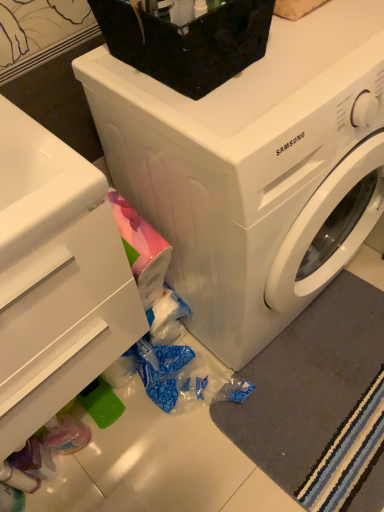
Question: Is white glossy drawer at lower left located outside black plastic container at upper center?

Choices:
 (A) no
 (B) yes

Answer: (B)

Question: From a real-world perspective, is white glossy drawer at lower left located beneath black plastic container at upper center?

Choices:
 (A) yes
 (B) no

Answer: (A)

Question: From a real-world perspective, is white glossy drawer at lower left on top of black plastic container at upper center?

Choices:
 (A) yes
 (B) no

Answer: (B)

Question: Does white glossy drawer at lower left appear on the left side of black plastic container at upper center?

Choices:
 (A) no
 (B) yes

Answer: (B)

Question: Does white glossy drawer at lower left have a greater height compared to black plastic container at upper center?

Choices:
 (A) yes
 (B) no

Answer: (A)

Question: In the image, is white glossy washing machine at center on the left side or the right side of white glossy drawer at lower left?

Choices:
 (A) left
 (B) right

Answer: (B)

Question: Do you think white glossy washing machine at center is within white glossy drawer at lower left, or outside of it?

Choices:
 (A) outside
 (B) inside

Answer: (A)

Question: Is point (337, 96) closer or farther from the camera than point (79, 284)?

Choices:
 (A) farther
 (B) closer

Answer: (B)

Question: From the image's perspective, is white glossy washing machine at center positioned above or below white glossy drawer at lower left?

Choices:
 (A) below
 (B) above

Answer: (B)

Question: Relative to white glossy washing machine at center, is white glossy drawer at lower left in front or behind?

Choices:
 (A) behind
 (B) front

Answer: (B)

Question: Is white glossy drawer at lower left bigger or smaller than white glossy washing machine at center?

Choices:
 (A) big
 (B) small

Answer: (B)

Question: From the image's perspective, is white glossy drawer at lower left located above or below white glossy washing machine at center?

Choices:
 (A) below
 (B) above

Answer: (A)

Question: Does point (3, 396) appear closer or farther from the camera than point (185, 158)?

Choices:
 (A) closer
 (B) farther

Answer: (B)

Question: From the image's perspective, relative to white glossy drawer at lower left, is black plastic container at upper center above or below?

Choices:
 (A) below
 (B) above

Answer: (B)

Question: Does point (213, 15) appear closer or farther from the camera than point (21, 355)?

Choices:
 (A) farther
 (B) closer

Answer: (B)